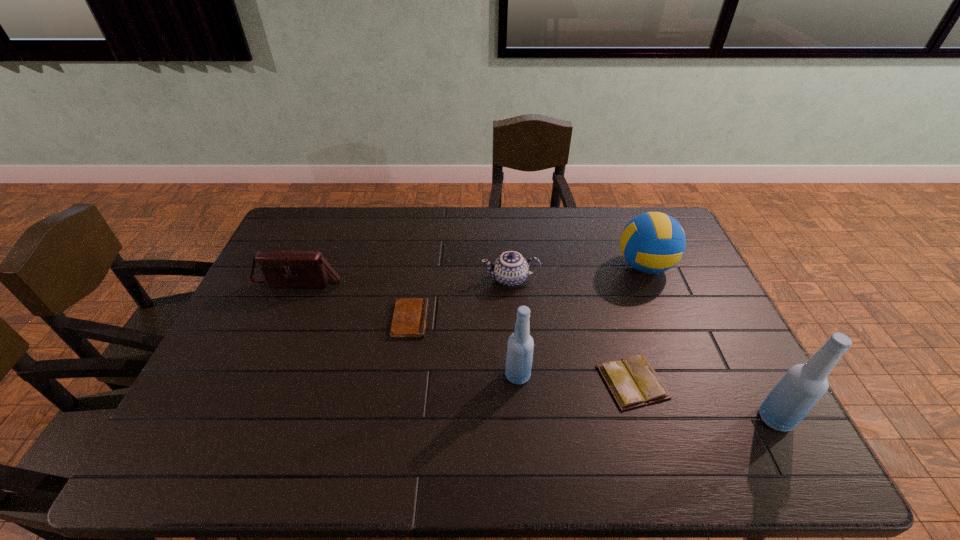
Locate an element on the screen. shoulder bag is located at coordinates (280, 269).

You are a GUI agent. You are given a task and a screenshot of the screen. Output one action in this format:
    pyautogui.click(x=<x>, y=<y>)
    Task: Click on the vacant space positioned on the right of the left bottle
    
    Given the screenshot: What is the action you would take?
    pyautogui.click(x=584, y=375)

The image size is (960, 540). What are the coordinates of `vacant position located 0.090m on the back of the nearer bottle` in the screenshot? It's located at (751, 373).

At what (x,y) coordinates should I click in order to perform the action: click on free spot located 0.250m from the spout of the fifth tallest object. Please return your answer as a coordinate pair (x, y). The height and width of the screenshot is (540, 960). Looking at the image, I should click on pyautogui.click(x=403, y=279).

Identify the location of free space located 0.070m from the spout of the fifth tallest object. The height and width of the screenshot is (540, 960). (460, 279).

You are a GUI agent. You are given a task and a screenshot of the screen. Output one action in this format:
    pyautogui.click(x=<x>, y=<y>)
    Task: Click on the vacant space positioned from the spout of the fifth tallest object
    The height and width of the screenshot is (540, 960).
    Given the screenshot: What is the action you would take?
    pyautogui.click(x=416, y=279)

The height and width of the screenshot is (540, 960). What are the coordinates of `vacant space located 0.130m on the front of the third tallest object` in the screenshot? It's located at (665, 317).

Locate an element on the screen. The width and height of the screenshot is (960, 540). free spot located on the spine side of the left diary is located at coordinates (546, 319).

Locate an element on the screen. The height and width of the screenshot is (540, 960). free space located 0.180m on the back of the right diary is located at coordinates (611, 307).

Where is `vacant region located on the front flap of the shoulder bag`? Image resolution: width=960 pixels, height=540 pixels. vacant region located on the front flap of the shoulder bag is located at coordinates (266, 362).